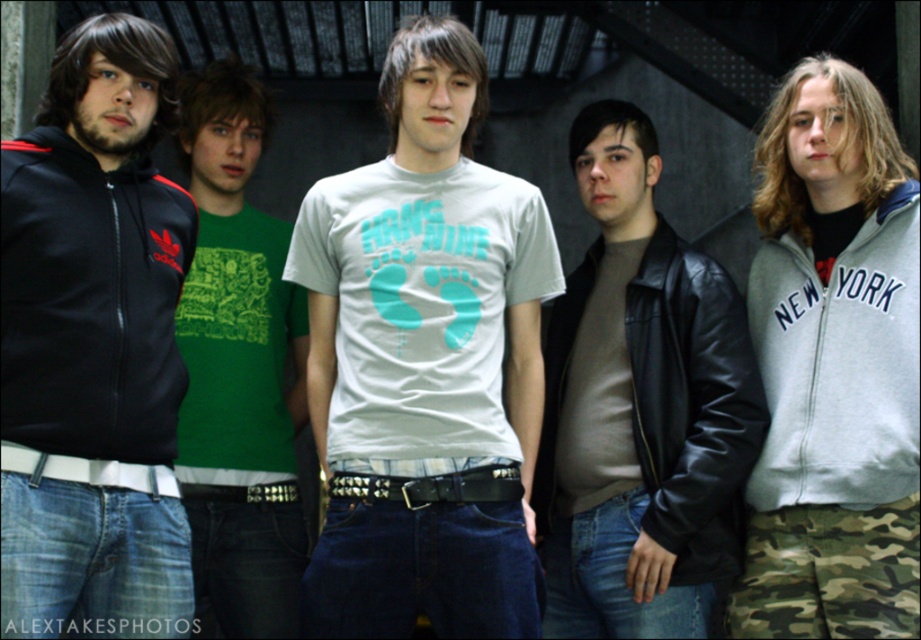
Question: Which point appears closest to the camera in this image?

Choices:
 (A) (216, 417)
 (B) (44, 310)
 (C) (740, 532)
 (D) (391, 464)

Answer: (B)

Question: Which object is closer to the camera taking this photo?

Choices:
 (A) gray fleece sweatshirt at upper right
 (B) matte black hoodie at left

Answer: (B)

Question: Which object is positioned closest to the green printed t-shirt at center?

Choices:
 (A) black leather jacket at center
 (B) white matte t-shirt at center
 (C) matte black hoodie at left

Answer: (C)

Question: Does white matte t-shirt at center lie in front of gray fleece sweatshirt at upper right?

Choices:
 (A) yes
 (B) no

Answer: (A)

Question: Does green printed t-shirt at center come behind gray fleece sweatshirt at upper right?

Choices:
 (A) yes
 (B) no

Answer: (B)

Question: Does matte black hoodie at left have a smaller size compared to black leather jacket at center?

Choices:
 (A) no
 (B) yes

Answer: (B)